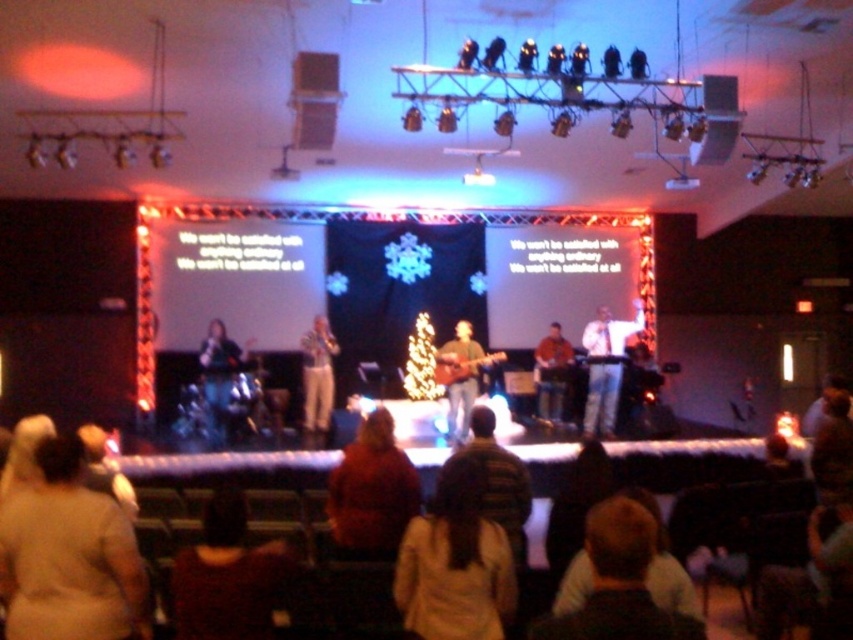
You are a photographer at the event and need to capture a shot of both the red velvet sweater at lower center and the jeans at stage right. Based on their positions, which one is closer to the camera?

The red velvet sweater at lower center is positioned under jeans at stage right, meaning it is closer to the camera since it is below the jeans.